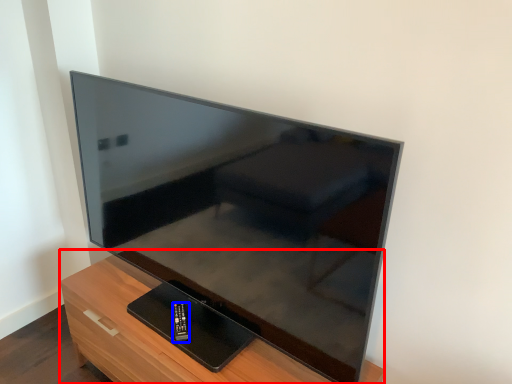
Question: Which of the following is the closest to the observer, furniture (highlighted by a red box) or control (highlighted by a blue box)?

Choices:
 (A) furniture
 (B) control

Answer: (A)